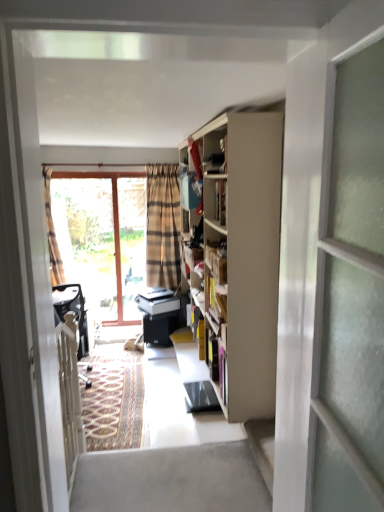
Where is `smooth concrete step at lower right`? This screenshot has height=512, width=384. smooth concrete step at lower right is located at coordinates (262, 447).

Identify the location of smooth concrete step at lower right. This screenshot has width=384, height=512. (262, 447).

Which object is further away from the camera taking this photo, plaid fabric curtain at left or transparent glass screen door at right?

plaid fabric curtain at left is more distant.

Would you say plaid fabric curtain at left is outside transparent glass screen door at right?

plaid fabric curtain at left is positioned outside transparent glass screen door at right.

Considering the points (49, 237) and (377, 398), which point is in front, point (49, 237) or point (377, 398)?

The point (377, 398) is closer.

Considering the sizes of objects plaid fabric curtain at left and transparent glass screen door at right in the image provided, who is bigger, plaid fabric curtain at left or transparent glass screen door at right?

Answer: With larger size is transparent glass screen door at right.

Is point (116, 254) farther from viewer compared to point (361, 337)?

Yes, it is.

How far apart are translucent glass window at left and transparent glass screen door at right?

translucent glass window at left and transparent glass screen door at right are 4.29 meters apart from each other.

Based on the photo, is translucent glass window at left turned away from transparent glass screen door at right?

translucent glass window at left is not turned away from transparent glass screen door at right.

Can you confirm if translucent glass window at left is positioned to the left of transparent glass screen door at right?

Yes, translucent glass window at left is to the left of transparent glass screen door at right.

From a real-world perspective, is matte wooden cabinet at upper center physically below transparent glass screen door at right?

No.

Considering the sizes of matte wooden cabinet at upper center and transparent glass screen door at right in the image, is matte wooden cabinet at upper center taller or shorter than transparent glass screen door at right?

In the image, matte wooden cabinet at upper center appears to be shorter than transparent glass screen door at right.

Would you say matte wooden cabinet at upper center is a long distance from transparent glass screen door at right?

Absolutely, matte wooden cabinet at upper center is distant from transparent glass screen door at right.

From the image's perspective, between matte wooden cabinet at upper center and transparent glass screen door at right, who is located below?

From the image's view, transparent glass screen door at right is below.

Is transparent glass screen door at right wider or thinner than smooth concrete step at lower right?

transparent glass screen door at right is wider than smooth concrete step at lower right.

Find the location of a particular element. This screenshot has width=384, height=512. screen door to the left of smooth concrete step at lower right is located at coordinates (351, 295).

Measure the distance from transparent glass screen door at right to smooth concrete step at lower right.

transparent glass screen door at right is 4.73 feet away from smooth concrete step at lower right.

Based on the photo, in terms of height, does transparent glass screen door at right look taller or shorter compared to smooth concrete step at lower right?

Considering their sizes, transparent glass screen door at right has more height than smooth concrete step at lower right.

Consider the image. Can you tell me how much smooth concrete step at lower right and plaid fabric curtain at left differ in facing direction?

The facing directions of smooth concrete step at lower right and plaid fabric curtain at left are 94.7 degrees apart.

Considering the sizes of smooth concrete step at lower right and plaid fabric curtain at left in the image, is smooth concrete step at lower right bigger or smaller than plaid fabric curtain at left?

smooth concrete step at lower right is smaller than plaid fabric curtain at left.

From their relative heights in the image, would you say smooth concrete step at lower right is taller or shorter than plaid fabric curtain at left?

smooth concrete step at lower right is shorter than plaid fabric curtain at left.

From the image's perspective, is smooth concrete step at lower right located beneath plaid fabric curtain at left?

Yes.

In the scene shown: From a real-world perspective, who is located higher, matte wooden cabinet at upper center or plaid fabric curtain at left?

matte wooden cabinet at upper center, from a real-world perspective.

Is matte wooden cabinet at upper center positioned with its back to plaid fabric curtain at left?

No.

Which of these two, matte wooden cabinet at upper center or plaid fabric curtain at left, is bigger?

plaid fabric curtain at left.

Find the location of `cabinet above the plaid fabric curtain at left (from the image's perspective)`. cabinet above the plaid fabric curtain at left (from the image's perspective) is located at coordinates (215, 151).

Is transparent glass screen door at right far away from translucent glass window at left?

Indeed, transparent glass screen door at right is not near translucent glass window at left.

From a real-world perspective, between transparent glass screen door at right and translucent glass window at left, who is vertically lower?

In real-world perspective, translucent glass window at left is lower.

Which is more to the left, transparent glass screen door at right or translucent glass window at left?

Positioned to the left is translucent glass window at left.

This screenshot has height=512, width=384. What are the coordinates of `curtain that is behind the transparent glass screen door at right` in the screenshot? It's located at (52, 234).

Identify the location of screen door lying below the translucent glass window at left (from the image's perspective). (351, 295).

Estimate the real-world distances between objects in this image. Which object is closer to translucent glass window at left, smooth concrete step at lower right or plaid fabric curtain at left?

plaid fabric curtain at left.

When comparing their distances from matte wooden cabinet at upper center, does plaid fabric curtain at left or transparent glass screen door at right seem closer?

The object closer to matte wooden cabinet at upper center is transparent glass screen door at right.

From the image, which object appears to be farther from matte wooden cabinet at upper center, smooth concrete step at lower right or plaid fabric curtain at left?

plaid fabric curtain at left lies further to matte wooden cabinet at upper center than the other object.

Based on their spatial positions, is transparent glass screen door at right or smooth concrete step at lower right further from matte wooden cabinet at upper center?

transparent glass screen door at right is further to matte wooden cabinet at upper center.

Looking at the image, which one is located closer to plaid fabric curtain at left, translucent glass window at left or transparent glass screen door at right?

translucent glass window at left lies closer to plaid fabric curtain at left than the other object.

Looking at the image, which one is located further to translucent glass window at left, smooth concrete step at lower right or matte wooden cabinet at upper center?

smooth concrete step at lower right lies further to translucent glass window at left than the other object.

Based on their spatial positions, is plaid fabric curtain at left or translucent glass window at left further from smooth concrete step at lower right?

The object further to smooth concrete step at lower right is plaid fabric curtain at left.

When comparing their distances from plaid fabric curtain at left, does smooth concrete step at lower right or transparent glass screen door at right seem closer?

smooth concrete step at lower right.

Identify the location of curtain between smooth concrete step at lower right and translucent glass window at left in the front-back direction. Image resolution: width=384 pixels, height=512 pixels. (52, 234).

Image resolution: width=384 pixels, height=512 pixels. Find the location of `stairwell between transparent glass screen door at right and translucent glass window at left in the front-back direction`. stairwell between transparent glass screen door at right and translucent glass window at left in the front-back direction is located at coordinates (262, 447).

Find the location of a particular element. stairwell positioned between transparent glass screen door at right and plaid fabric curtain at left from near to far is located at coordinates (262, 447).

Identify the location of cabinet between smooth concrete step at lower right and plaid fabric curtain at left in the front-back direction. Image resolution: width=384 pixels, height=512 pixels. (215, 151).